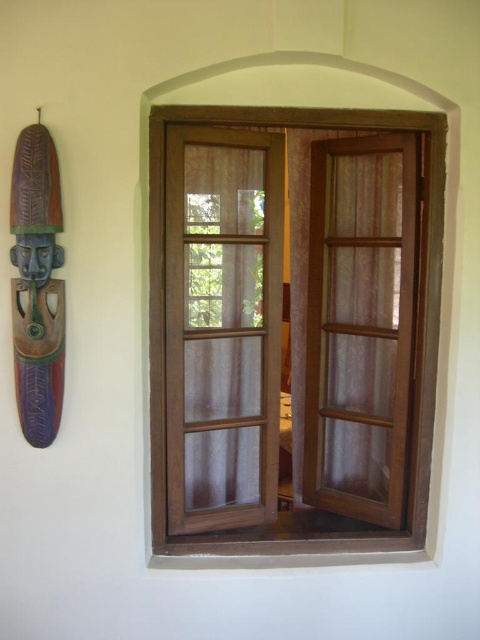
You are standing in front of the window and want to know which curtain is closer to you. The curtains are the translucent sheer curtain at center and the sheer fabric curtain at right. Can you determine which one is closer based on their sizes?

The translucent sheer curtain at center is smaller than the sheer fabric curtain at right, so the sheer fabric curtain at right is closer to you because closer objects appear larger.

You are standing in front of the wooden window and want to place a small plant exactly at the center of the window frame. The window frame is 1 meter wide and 1.5 meters tall. If the center point of the window frame is at coordinate point (223,323), where would you place the plant?

The center point of the window frame is at coordinate point (223,323), so you should place the plant at that exact point to ensure it is centered.